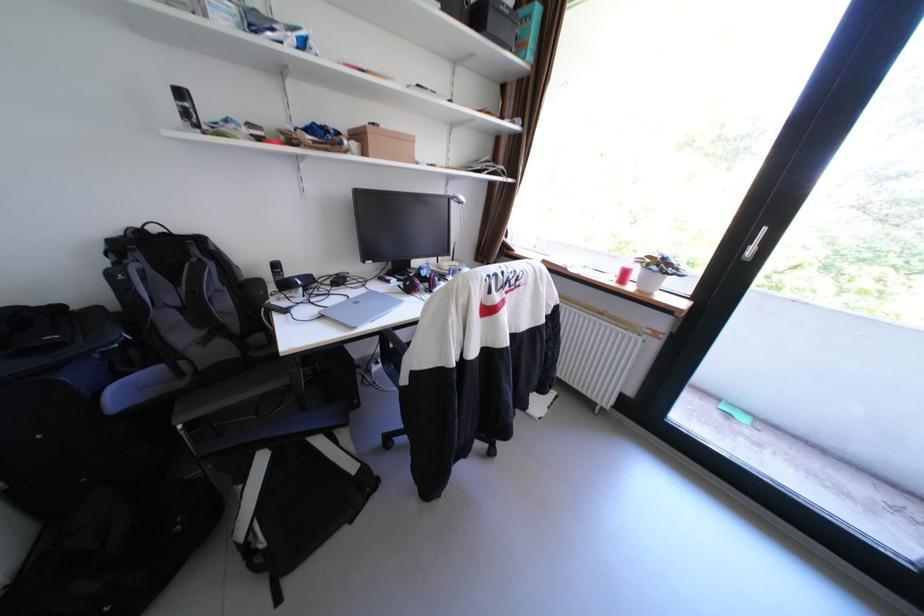
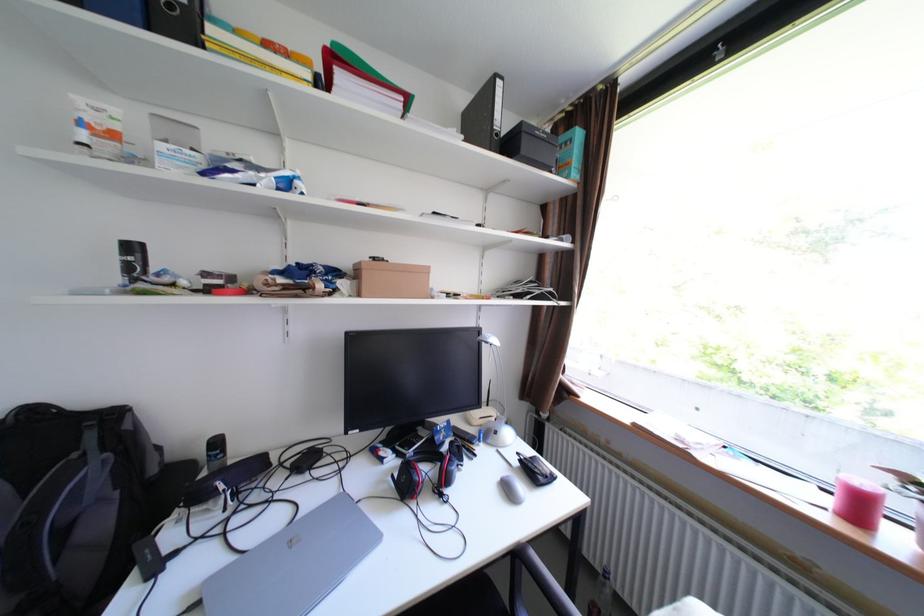
In the second image, find the point that corresponds to pixel 332 317 in the first image.

(208, 604)